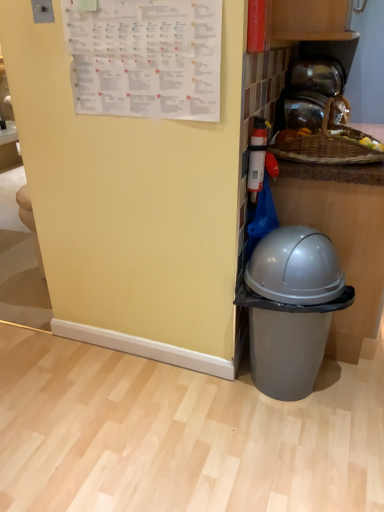
Question: Is gray plastic trash can at lower right facing towards white paper calendar at upper left?

Choices:
 (A) yes
 (B) no

Answer: (B)

Question: From the image's perspective, is gray plastic trash can at lower right above white paper calendar at upper left?

Choices:
 (A) no
 (B) yes

Answer: (A)

Question: Is gray plastic trash can at lower right next to white paper calendar at upper left and touching it?

Choices:
 (A) no
 (B) yes

Answer: (A)

Question: Is gray plastic trash can at lower right located outside white paper calendar at upper left?

Choices:
 (A) no
 (B) yes

Answer: (B)

Question: From a real-world perspective, is gray plastic trash can at lower right positioned over white paper calendar at upper left based on gravity?

Choices:
 (A) yes
 (B) no

Answer: (B)

Question: Does gray plastic trash can at lower right appear on the right side of white paper calendar at upper left?

Choices:
 (A) no
 (B) yes

Answer: (B)

Question: From a real-world perspective, is woven wood basket at upper right physically below transparent glass jar at upper right?

Choices:
 (A) yes
 (B) no

Answer: (A)

Question: Would you say woven wood basket at upper right contains transparent glass jar at upper right?

Choices:
 (A) yes
 (B) no

Answer: (B)

Question: Could you tell me if woven wood basket at upper right is turned towards transparent glass jar at upper right?

Choices:
 (A) no
 (B) yes

Answer: (A)

Question: Is woven wood basket at upper right bigger than transparent glass jar at upper right?

Choices:
 (A) no
 (B) yes

Answer: (B)

Question: From a real-world perspective, is woven wood basket at upper right positioned over transparent glass jar at upper right based on gravity?

Choices:
 (A) yes
 (B) no

Answer: (B)

Question: Is woven wood basket at upper right at the left side of transparent glass jar at upper right?

Choices:
 (A) yes
 (B) no

Answer: (A)

Question: From a real-world perspective, is white paper calendar at upper left on top of woven wood basket at upper right?

Choices:
 (A) yes
 (B) no

Answer: (A)